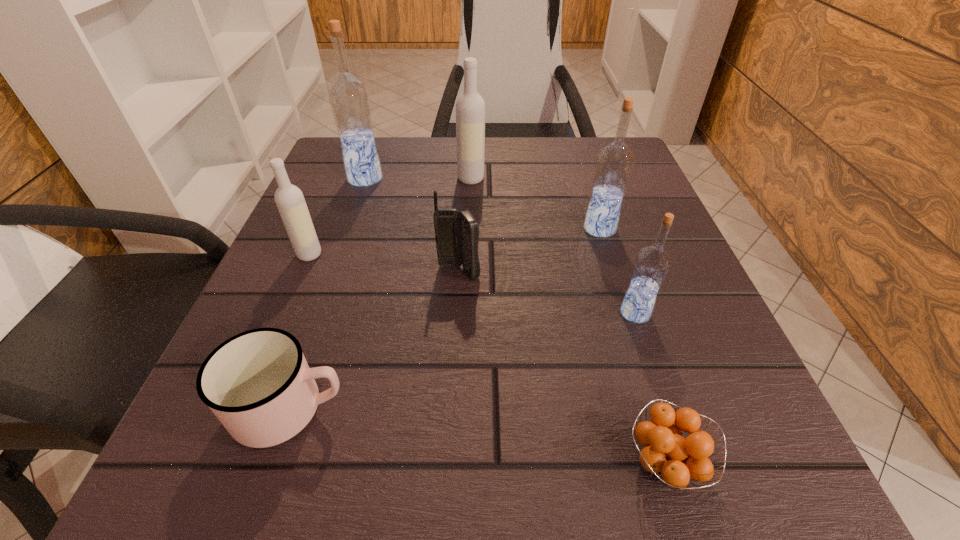
In the image, there is a desktop. In order to click on free space at the near edge in this screenshot , I will do `click(539, 505)`.

Identify the location of free space at the left edge of the desktop. (339, 235).

You are a GUI agent. You are given a task and a screenshot of the screen. Output one action in this format:
    pyautogui.click(x=<x>, y=<y>)
    Task: Click on the vacant space at the right edge of the desktop
    
    Given the screenshot: What is the action you would take?
    pyautogui.click(x=686, y=275)

Identify the location of vacant area between the third nearest object and the tallest object. (500, 246).

Find the location of `blank region between the bigger white vodka and the sixth farthest object`. blank region between the bigger white vodka and the sixth farthest object is located at coordinates (553, 246).

At what (x,y) coordinates should I click in order to perform the action: click on free space that is in between the farther white vodka and the fourth farthest vodka. Please return your answer as a coordinate pair (x, y). This screenshot has height=540, width=960. Looking at the image, I should click on (390, 217).

Where is `empty location between the right white vodka and the seventh tallest object`? empty location between the right white vodka and the seventh tallest object is located at coordinates (380, 293).

Find the location of a particular element. This screenshot has width=960, height=540. free space between the left white vodka and the bigger white vodka is located at coordinates (390, 217).

Find the location of a particular element. vacant space that is in between the left white vodka and the biggest blue vodka is located at coordinates (337, 217).

Where is `vacant area between the smaller white vodka and the third vodka from left to right`? This screenshot has width=960, height=540. vacant area between the smaller white vodka and the third vodka from left to right is located at coordinates (390, 217).